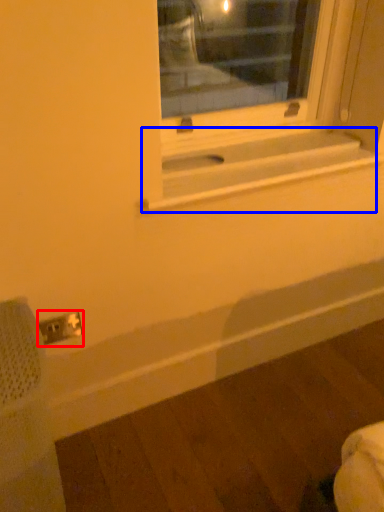
Question: Which point is closer to the camera, electric outlet (highlighted by a red box) or window sill (highlighted by a blue box)?

Choices:
 (A) electric outlet
 (B) window sill

Answer: (B)